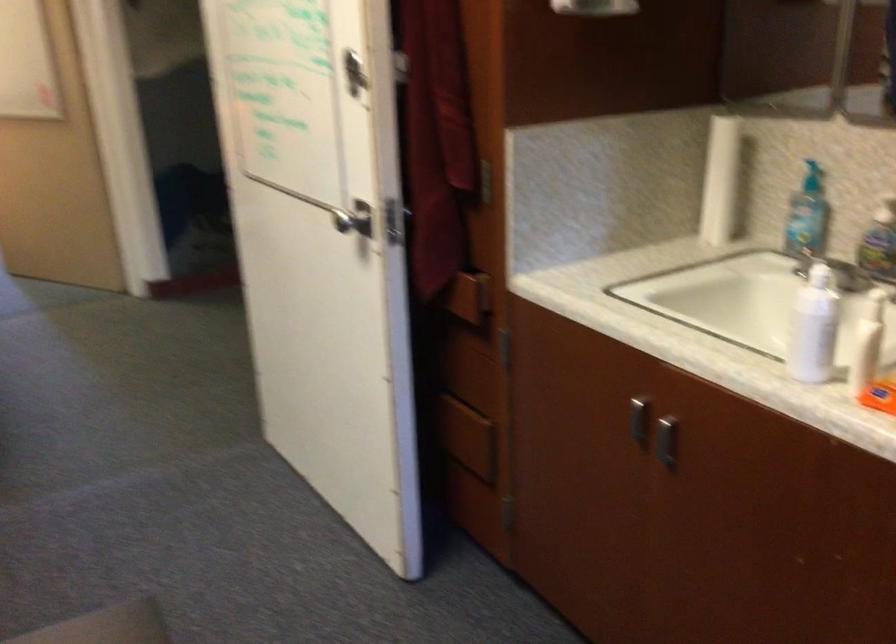
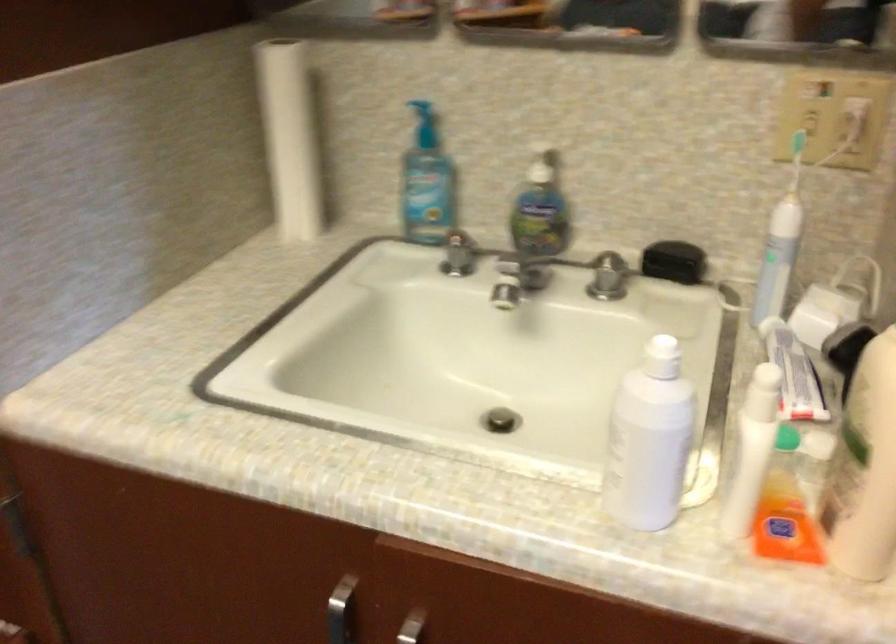
Locate, in the second image, the point that corresponds to point (670, 418) in the first image.

(411, 627)